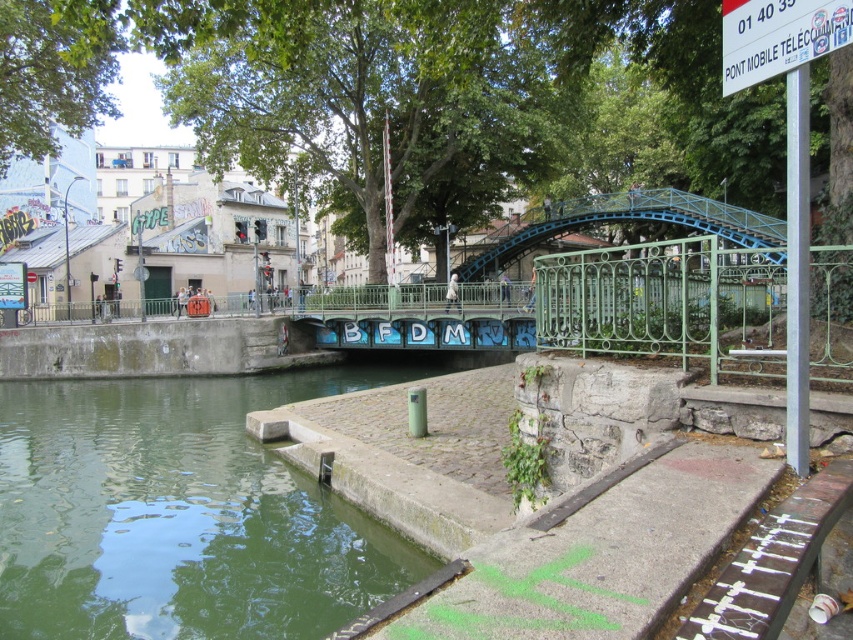
Question: Which of the following is the farthest from the observer?

Choices:
 (A) (757, 19)
 (B) (137, 552)
 (C) (718, 216)

Answer: (C)

Question: Can you confirm if green wrought iron railing at center is bigger than green wrought iron bridge at center?

Choices:
 (A) yes
 (B) no

Answer: (B)

Question: Observing the image, what is the correct spatial positioning of green concrete river at lower left in reference to green wrought iron bridge at center?

Choices:
 (A) above
 (B) below

Answer: (B)

Question: Is green concrete river at lower left bigger than green wrought iron railing at center?

Choices:
 (A) yes
 (B) no

Answer: (B)

Question: Which object appears closest to the camera in this image?

Choices:
 (A) green wrought iron bridge at center
 (B) green wrought iron railing at center
 (C) white plastic sign at upper right
 (D) green concrete river at lower left

Answer: (C)

Question: Which of the following is the closest to the observer?

Choices:
 (A) (119, 588)
 (B) (787, 58)
 (C) (537, 300)

Answer: (B)